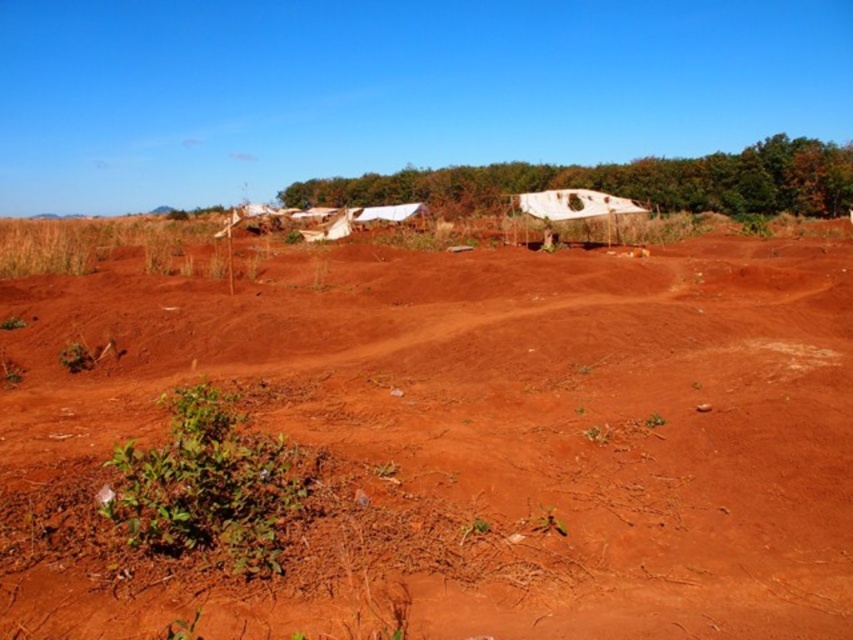
You are a geologist examining a dry landscape. You notice a point marked at coordinates (459,440). What does this point indicate in the scene?

The point at coordinates (459,440) marks dull reddish brown soil at center.

You are a hiker carrying a 20kg backpack and need to reach the green leafy trees at upper center from the green leafy plant at lower left. Considering the distance between them, is it feasible to walk directly from the plant to the trees without any rest stops?

The distance between the green leafy trees at upper center and the green leafy plant at lower left is 64.41 meters. Carrying a 20kg backpack over this short distance is manageable without needing rest stops.